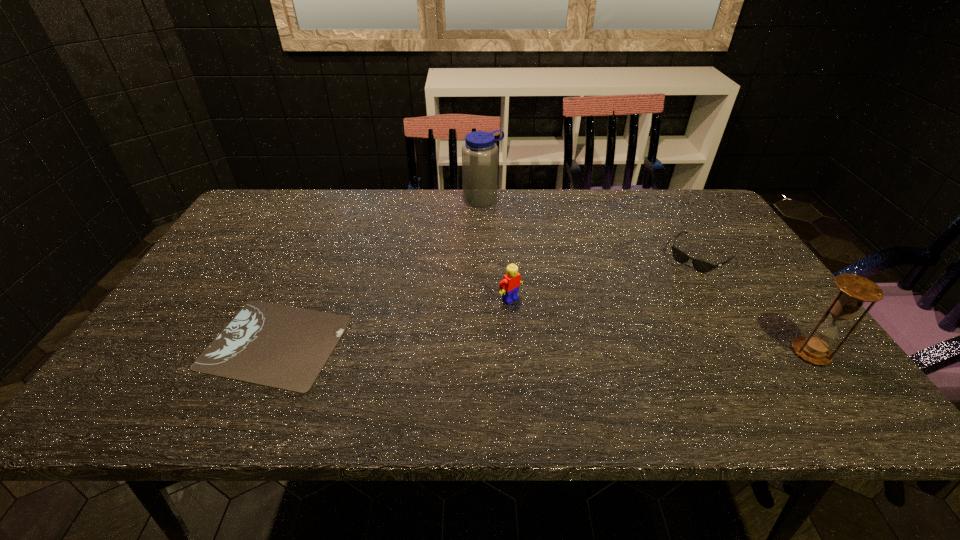
I want to click on vacant space located 0.160m on the front-facing side of the second shortest object, so [x=656, y=299].

The height and width of the screenshot is (540, 960). Identify the location of vacant space located 0.070m on the front-facing side of the second shortest object. coord(673,282).

Locate an element on the screen. vacant region located 0.210m with a carrying loop on the side of the water bottle is located at coordinates (523, 242).

Locate an element on the screen. The image size is (960, 540). vacant position located with a carrying loop on the side of the water bottle is located at coordinates [553, 274].

Locate an element on the screen. free spot located 0.250m with a carrying loop on the side of the water bottle is located at coordinates (531, 250).

What are the coordinates of `vacant space located 0.130m on the front-facing side of the Lego` in the screenshot? It's located at (556, 336).

The image size is (960, 540). I want to click on vacant space positioned on the front-facing side of the Lego, so click(585, 360).

Image resolution: width=960 pixels, height=540 pixels. I want to click on blank space located 0.100m on the front-facing side of the Lego, so click(x=546, y=328).

At what (x,y) coordinates should I click in order to perform the action: click on object located in the far edge section of the desktop. Please return your answer as a coordinate pair (x, y). Looking at the image, I should click on pyautogui.click(x=479, y=153).

Where is `mousepad that is at the near edge`? The width and height of the screenshot is (960, 540). mousepad that is at the near edge is located at coordinates (284, 347).